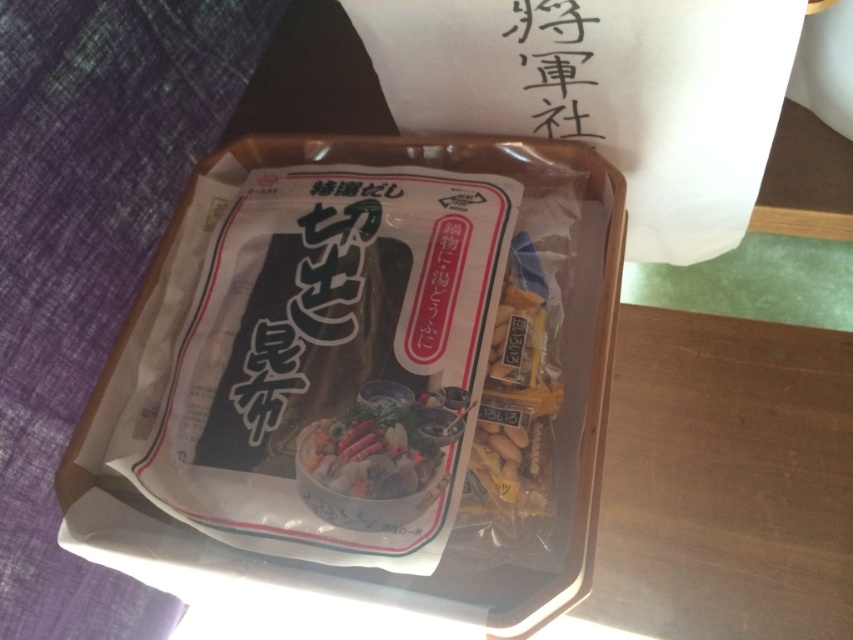
Does transparent plastic bag of seaweed at center have a greater width compared to shiny plastic food at center?

Yes.

Does point (376, 317) come farther from viewer compared to point (363, 488)?

Yes, point (376, 317) is farther from viewer.

Is point (305, 212) farther from camera compared to point (370, 467)?

Yes, point (305, 212) is farther from viewer.

Where is `transparent plastic bag of seaweed at center`? The height and width of the screenshot is (640, 853). transparent plastic bag of seaweed at center is located at coordinates (337, 364).